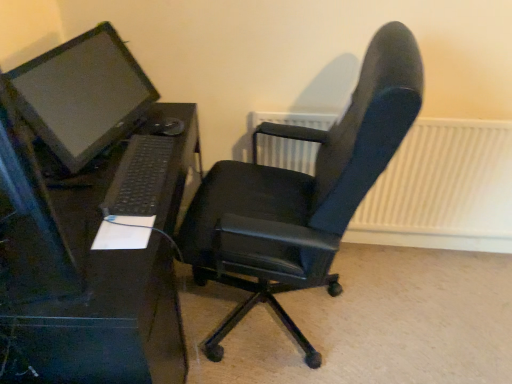
Image resolution: width=512 pixels, height=384 pixels. I want to click on vacant space underneath black plastic keyboard at lower left (from a real-world perspective), so click(x=139, y=168).